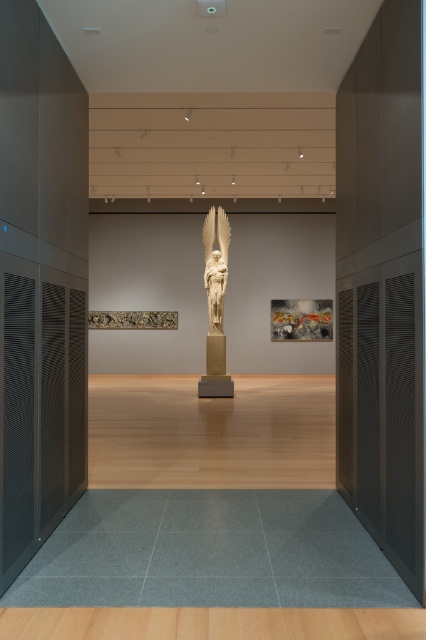
You are an art curator planning to display a new sculpture that requires a minimum height clearance of 3 meters. Given the white marble statue at center and the gold textured sculpture at center in the gallery, which one would be suitable for this requirement?

The white marble statue at center is much taller than the gold textured sculpture at center, so it would be suitable for the new sculpture requiring a minimum height clearance of 3 meters.

You are standing in the art gallery and want to locate the exact point at coordinates point (215, 305). Which object in the scene contains this point?

The point (215, 305) is located on the white marble statue at center.

You are standing in the art gallery and looking at the statue. There are two points marked on the statue. One is at coordinate point (209,380) and the other is at point (302,314). Which point is closer to your viewpoint?

Point (209,380) is closer to the camera than point (302,314).